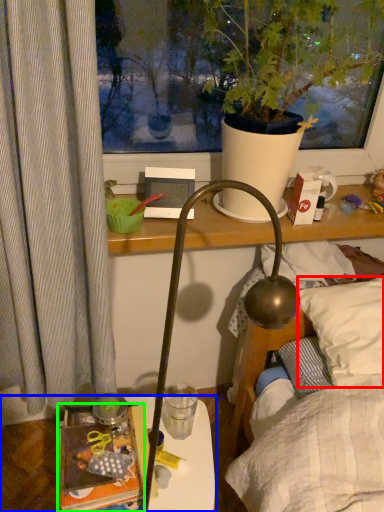
Question: Which is farther away from pillow (highlighted by a red box)? table (highlighted by a blue box) or book (highlighted by a green box)?

Choices:
 (A) table
 (B) book

Answer: (A)